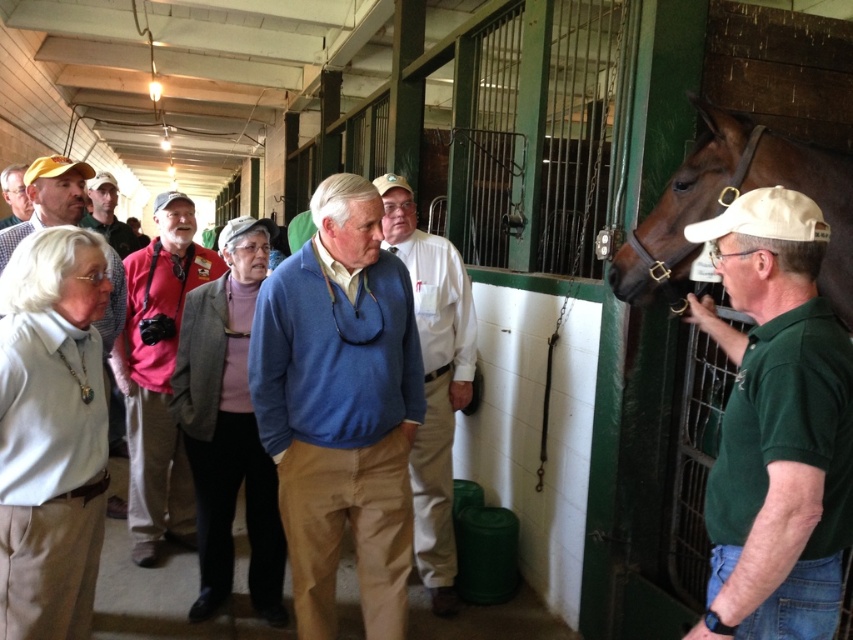
Question: Which of the following is the farthest from the observer?

Choices:
 (A) (675, 285)
 (B) (129, 337)

Answer: (B)

Question: Which object is closer to the camera taking this photo?

Choices:
 (A) matte brown jacket at center
 (B) white matte shirt at center

Answer: (B)

Question: Is gray wool coat at center thinner than red shirt at center?

Choices:
 (A) yes
 (B) no

Answer: (A)

Question: Does red shirt at center appear on the right side of matte pink shirt at center?

Choices:
 (A) yes
 (B) no

Answer: (A)

Question: Which object is closer to the camera taking this photo?

Choices:
 (A) green matte shirt at right
 (B) blue sweater at center
 (C) brown glossy horse at right
 (D) matte brown jacket at center

Answer: (A)

Question: Is brown glossy horse at right to the left of matte brown jacket at center from the viewer's perspective?

Choices:
 (A) no
 (B) yes

Answer: (A)